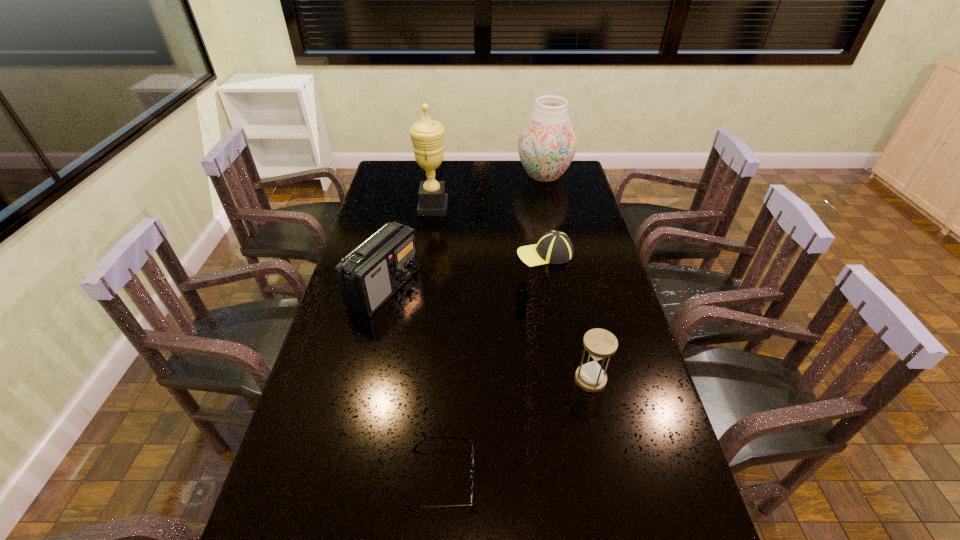
You are a GUI agent. You are given a task and a screenshot of the screen. Output one action in this format:
    pyautogui.click(x=<x>, y=<y>)
    Task: Click on the free region at the far right corner of the desktop
    The width and height of the screenshot is (960, 540).
    Given the screenshot: What is the action you would take?
    568,183

Identify the location of free area in between the second tallest object and the baseball cap. (544, 215).

Locate an element on the screen. The width and height of the screenshot is (960, 540). free space between the farthest object and the Lego is located at coordinates (533, 239).

Where is `blank region between the third tallest object and the Lego`? The image size is (960, 540). blank region between the third tallest object and the Lego is located at coordinates (453, 295).

Locate an element on the screen. The image size is (960, 540). blank region between the tallest object and the Lego is located at coordinates (477, 255).

In order to click on free space between the sixth farthest object and the tallest object in this screenshot , I will do `click(512, 293)`.

Find the location of `free space between the third tallest object and the vase`. free space between the third tallest object and the vase is located at coordinates (464, 232).

This screenshot has width=960, height=540. I want to click on blank region between the fifth shortest object and the vase, so click(464, 232).

You are a GUI agent. You are given a task and a screenshot of the screen. Output one action in this format:
    pyautogui.click(x=<x>, y=<y>)
    Task: Click on the empty location between the hourglass and the baseball cap
    
    Given the screenshot: What is the action you would take?
    pyautogui.click(x=567, y=316)

Find the location of a particular element. free space between the Lego and the baseball cap is located at coordinates (533, 278).